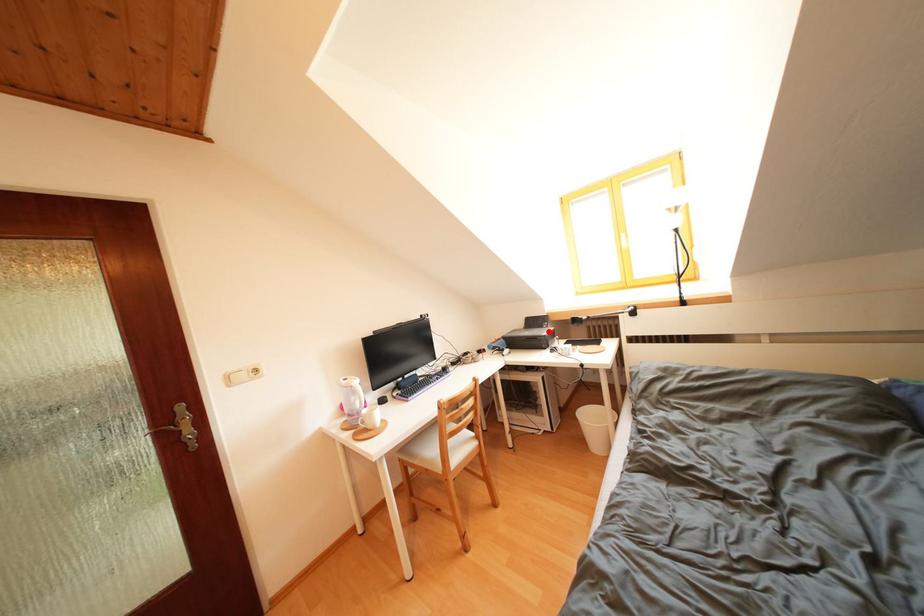
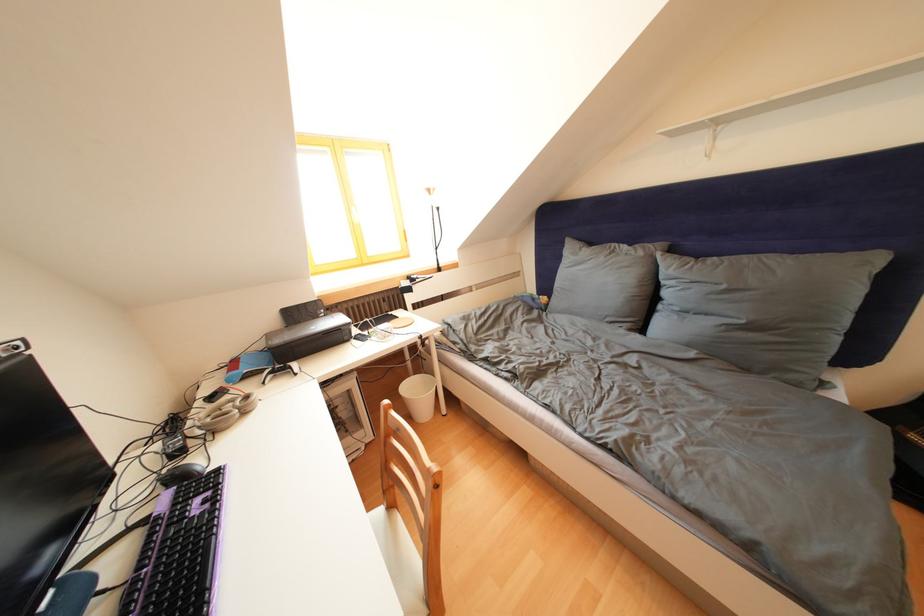
Question: I am providing you with two images of the same scene from different viewpoints. Given a red point in image1, look at the same physical point in image2. Is it:

Choices:
 (A) Closer to the viewpoint
 (B) Farther from the viewpoint

Answer: (A)